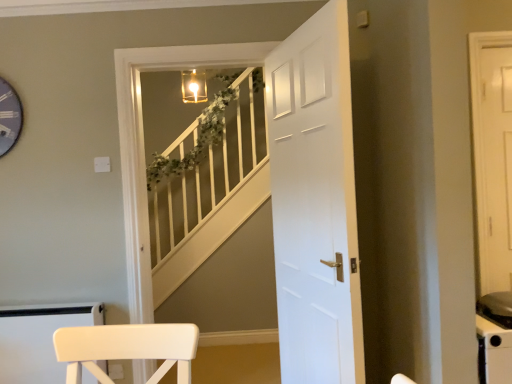
Question: From the image's perspective, is white wooden staircase at center located above or below white matte door at center?

Choices:
 (A) below
 (B) above

Answer: (A)

Question: Visually, is white wooden staircase at center positioned to the left or to the right of white matte door at center?

Choices:
 (A) left
 (B) right

Answer: (A)

Question: In terms of size, does white wooden staircase at center appear bigger or smaller than white matte door at center?

Choices:
 (A) small
 (B) big

Answer: (A)

Question: Is white matte door at center taller or shorter than white wooden staircase at center?

Choices:
 (A) tall
 (B) short

Answer: (A)

Question: Visually, is white matte door at center positioned to the left or to the right of white wooden staircase at center?

Choices:
 (A) left
 (B) right

Answer: (B)

Question: Considering their positions, is white matte door at center located in front of or behind white wooden staircase at center?

Choices:
 (A) front
 (B) behind

Answer: (A)

Question: Is point (338, 382) positioned closer to the camera than point (184, 135)?

Choices:
 (A) closer
 (B) farther

Answer: (A)